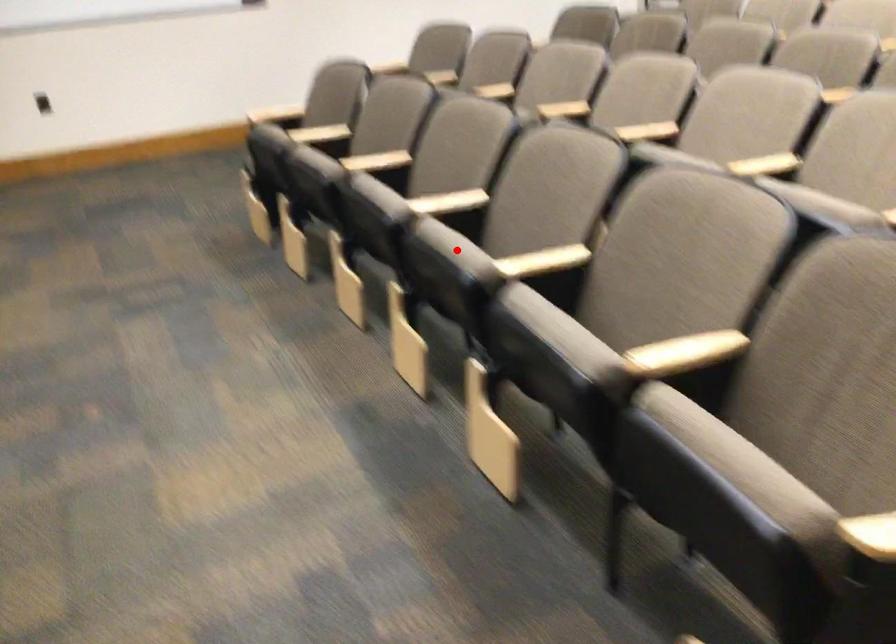
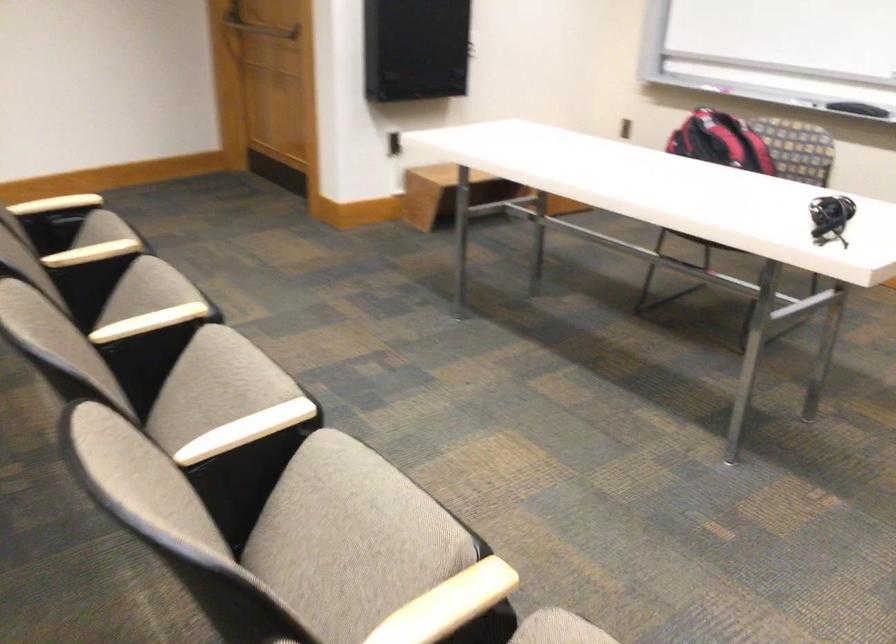
In the second image, find the point that corresponds to the highlighted location in the first image.

(214, 386)